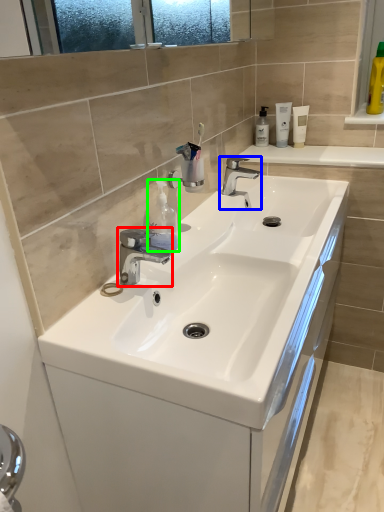
Question: Based on their relative distances, which object is farther from tap (highlighted by a red box)? Choose from tap (highlighted by a blue box) and cleaning product (highlighted by a green box).

Choices:
 (A) tap
 (B) cleaning product

Answer: (A)